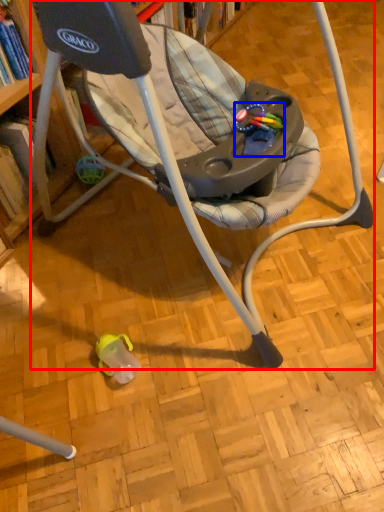
Question: Which of the following is the closest to the observer, chair (highlighted by a red box) or toy (highlighted by a blue box)?

Choices:
 (A) chair
 (B) toy

Answer: (A)